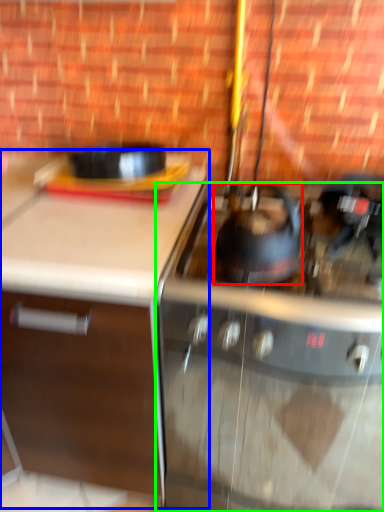
Question: Estimate the real-world distances between objects in this image. Which object is closer to kitchen appliance (highlighted by a red box), cabinetry (highlighted by a blue box) or gas stove (highlighted by a green box)?

Choices:
 (A) cabinetry
 (B) gas stove

Answer: (B)